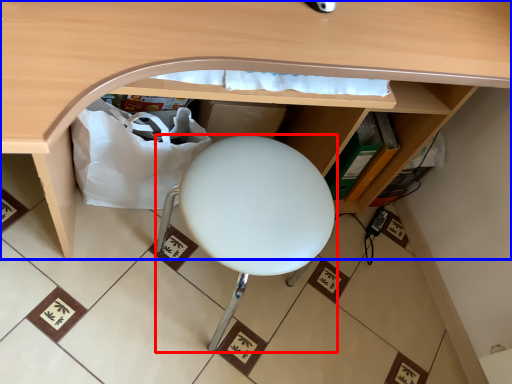
Question: Which object is closer to the camera taking this photo, furniture (highlighted by a red box) or desk (highlighted by a blue box)?

Choices:
 (A) furniture
 (B) desk

Answer: (B)